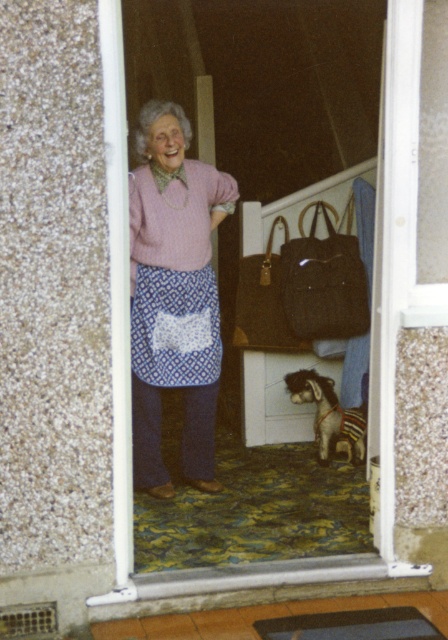
Question: Is transparent plastic screen door at center positioned in front of brown plush dog at lower center?

Choices:
 (A) yes
 (B) no

Answer: (A)

Question: Does brown woven bag at center have a lesser width compared to brown plush dog at lower center?

Choices:
 (A) no
 (B) yes

Answer: (A)

Question: Estimate the real-world distances between objects in this image. Which object is closer to the transparent plastic screen door at center?

Choices:
 (A) brown woven bag at center
 (B) brown plush dog at lower center

Answer: (B)

Question: Among these points, which one is farthest from the camera?

Choices:
 (A) (205, 280)
 (B) (111, 243)
 (C) (335, 240)
 (D) (362, 456)

Answer: (C)

Question: Which is nearer to the brown woven bag at center?

Choices:
 (A) pink knitted sweater at center
 (B) transparent plastic screen door at center
 (C) brown plush dog at lower center

Answer: (C)

Question: Considering the relative positions of pink knitted sweater at center and brown woven bag at center in the image provided, where is pink knitted sweater at center located with respect to brown woven bag at center?

Choices:
 (A) below
 (B) above

Answer: (A)